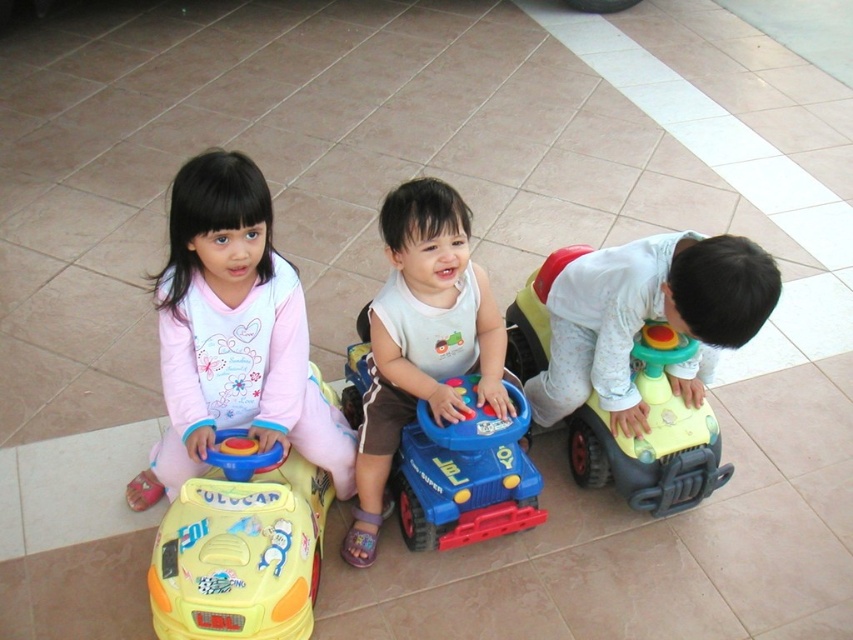
You are a parent observing the children playing with the matte white toy car at right and the yellow plastic toy car at left. Which car is taller?

The matte white toy car at right is taller than the yellow plastic toy car at left.

You are a photographer trying to capture a shot of the baby boy on the blue toy car in the middle. You notice a point at coordinates (233,333) in the image. What object is this point located on?

The point at coordinates (233,333) is located on the pink matte polyester dress at center.